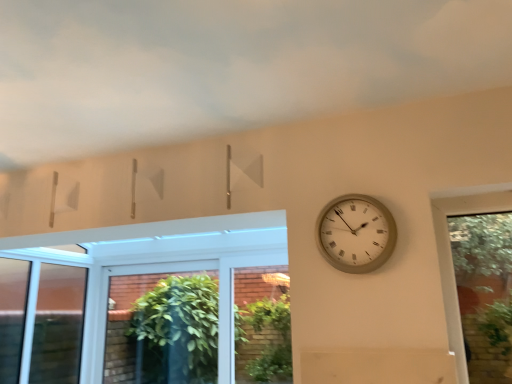
Where is `beige textured clock at right`? Image resolution: width=512 pixels, height=384 pixels. beige textured clock at right is located at coordinates (356, 233).

Where is `green leafy plant at lower center`? green leafy plant at lower center is located at coordinates (265, 340).

In terms of size, does cloudy sky at upper center appear bigger or smaller than beige textured clock at right?

Clearly, cloudy sky at upper center is larger in size than beige textured clock at right.

From a real-world perspective, is cloudy sky at upper center positioned above or below beige textured clock at right?

Clearly, from a real-world perspective, cloudy sky at upper center is above beige textured clock at right.

Is cloudy sky at upper center looking in the opposite direction of beige textured clock at right?

No, beige textured clock at right is not at the back of cloudy sky at upper center.

Are cloudy sky at upper center and beige textured clock at right beside each other?

They are not placed beside each other.

Considering the sizes of objects beige textured clock at right and cloudy sky at upper center in the image provided, who is taller, beige textured clock at right or cloudy sky at upper center?

Standing taller between the two is beige textured clock at right.

Is beige textured clock at right with cloudy sky at upper center?

beige textured clock at right and cloudy sky at upper center are not in contact.

Can you confirm if beige textured clock at right is thinner than cloudy sky at upper center?

Correct, the width of beige textured clock at right is less than that of cloudy sky at upper center.

Does point (335, 233) lie behind point (379, 93)?

Yes, it is behind point (379, 93).

Consider the image. Is beige textured clock at right looking in the opposite direction of green leafy plant at lower center?

No, beige textured clock at right is not facing away from green leafy plant at lower center.

Considering the positions of objects beige textured clock at right and green leafy plant at lower center in the image provided, who is more to the left, beige textured clock at right or green leafy plant at lower center?

Positioned to the left is green leafy plant at lower center.

From a real-world perspective, which is physically above, beige textured clock at right or green leafy plant at lower center?

beige textured clock at right.

In the scene shown: How different are the orientations of beige textured clock at right and green leafy plant at lower center in degrees?

The angular difference between beige textured clock at right and green leafy plant at lower center is 0.113 degrees.

Who is shorter, green leafy plant at lower center or cloudy sky at upper center?

cloudy sky at upper center.

Considering the sizes of objects green leafy plant at lower center and cloudy sky at upper center in the image provided, who is smaller, green leafy plant at lower center or cloudy sky at upper center?

green leafy plant at lower center is smaller.

Locate an element on the screen. The image size is (512, 384). plant that appears behind the cloudy sky at upper center is located at coordinates (265, 340).

Which is in front, point (247, 326) or point (21, 24)?

The point (21, 24) is closer.

Is cloudy sky at upper center taller than green leafy plant at lower center?

Incorrect, the height of cloudy sky at upper center is not larger of that of green leafy plant at lower center.

Is cloudy sky at upper center turned away from green leafy plant at lower center?

No, cloudy sky at upper center's orientation is not away from green leafy plant at lower center.

Which object is closer to the camera, cloudy sky at upper center or green leafy plant at lower center?

cloudy sky at upper center is closer to the camera.

Can you confirm if cloudy sky at upper center is bigger than green leafy plant at lower center?

Yes, cloudy sky at upper center is bigger than green leafy plant at lower center.

Is green leafy plant at lower center directly adjacent to beige textured clock at right?

No.

Who is smaller, green leafy plant at lower center or beige textured clock at right?

With smaller size is beige textured clock at right.

Considering the relative sizes of green leafy plant at lower center and beige textured clock at right in the image provided, is green leafy plant at lower center shorter than beige textured clock at right?

Incorrect, the height of green leafy plant at lower center does not fall short of that of beige textured clock at right.

I want to click on cloud that is above the beige textured clock at right (from the image's perspective), so click(x=226, y=66).

The height and width of the screenshot is (384, 512). Identify the location of wall clock on the right of cloudy sky at upper center. (356, 233).

Based on their spatial positions, is green leafy plant at lower center or cloudy sky at upper center further from beige textured clock at right?

green leafy plant at lower center lies further to beige textured clock at right than the other object.

Estimate the real-world distances between objects in this image. Which object is closer to green leafy plant at lower center, cloudy sky at upper center or beige textured clock at right?

beige textured clock at right is positioned closer to the anchor green leafy plant at lower center.

Estimate the real-world distances between objects in this image. Which object is further from beige textured clock at right, cloudy sky at upper center or green leafy plant at lower center?

Among the two, green leafy plant at lower center is located further to beige textured clock at right.

Considering their positions, is beige textured clock at right positioned closer to green leafy plant at lower center than cloudy sky at upper center?

The object closer to green leafy plant at lower center is beige textured clock at right.

From the image, which object appears to be farther from cloudy sky at upper center, beige textured clock at right or green leafy plant at lower center?

green leafy plant at lower center.

Estimate the real-world distances between objects in this image. Which object is further from cloudy sky at upper center, green leafy plant at lower center or beige textured clock at right?

green leafy plant at lower center is positioned further to the anchor cloudy sky at upper center.

You are a GUI agent. You are given a task and a screenshot of the screen. Output one action in this format:
    pyautogui.click(x=<x>, y=<y>)
    Task: Click on the wall clock between cloudy sky at upper center and green leafy plant at lower center in the front-back direction
    
    Given the screenshot: What is the action you would take?
    pyautogui.click(x=356, y=233)